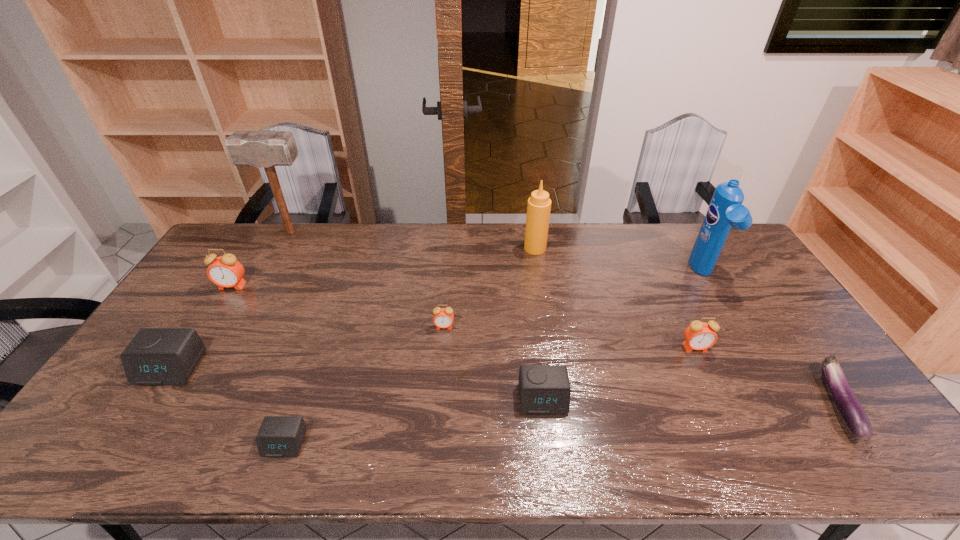
What are the coordinates of `the second pink alarm clock from right to left` in the screenshot? It's located at (443, 317).

Locate an element on the screen. The width and height of the screenshot is (960, 540). the fifth farthest object is located at coordinates (x=443, y=317).

Where is `the rightmost black alarm clock`? The image size is (960, 540). the rightmost black alarm clock is located at coordinates (544, 389).

Find the location of `the fifth alarm clock from left to right`. the fifth alarm clock from left to right is located at coordinates (544, 389).

What are the coordinates of `the smallest black alarm clock` in the screenshot? It's located at (279, 436).

You are a GUI agent. You are given a task and a screenshot of the screen. Output one action in this format:
    pyautogui.click(x=<x>, y=<y>)
    Task: Click on the nearest black alarm clock
    
    Given the screenshot: What is the action you would take?
    pyautogui.click(x=279, y=436)

The height and width of the screenshot is (540, 960). In order to click on the rightmost object in this screenshot , I will do `click(849, 409)`.

You are a GUI agent. You are given a task and a screenshot of the screen. Output one action in this format:
    pyautogui.click(x=<x>, y=<y>)
    Task: Click on the eggplant
    
    Given the screenshot: What is the action you would take?
    pyautogui.click(x=849, y=409)

Locate an element on the screen. The height and width of the screenshot is (540, 960). vacant space located on the striking face of the farthest object is located at coordinates (348, 233).

I want to click on vacant area situated 0.260m on the front of the shampoo, so click(753, 357).